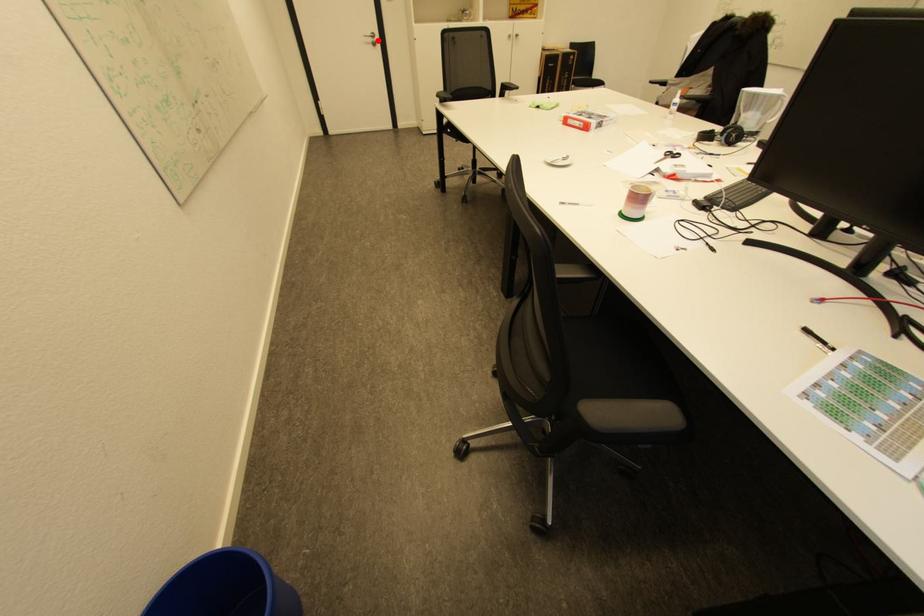
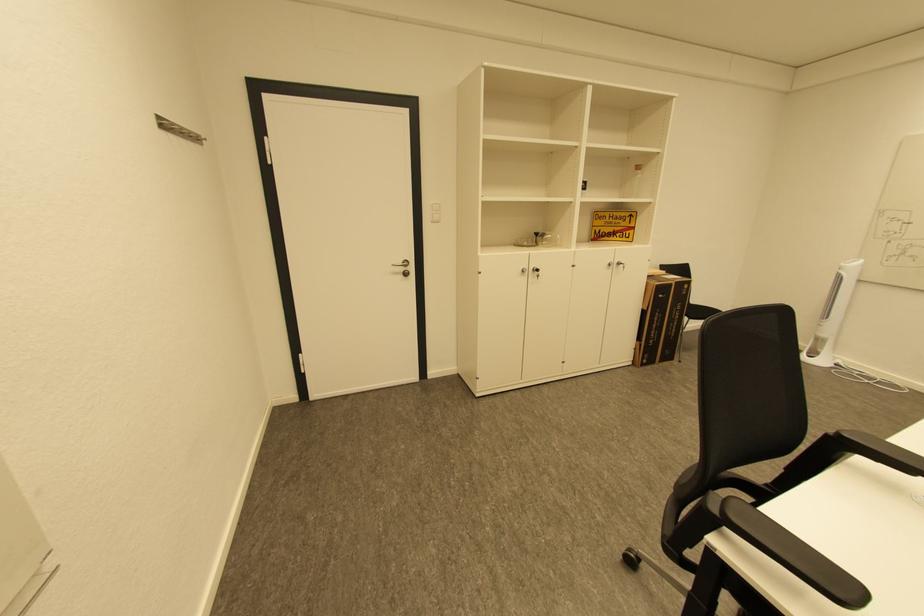
In the second image, find the point that corresponds to the highlighted location in the first image.

(408, 270)